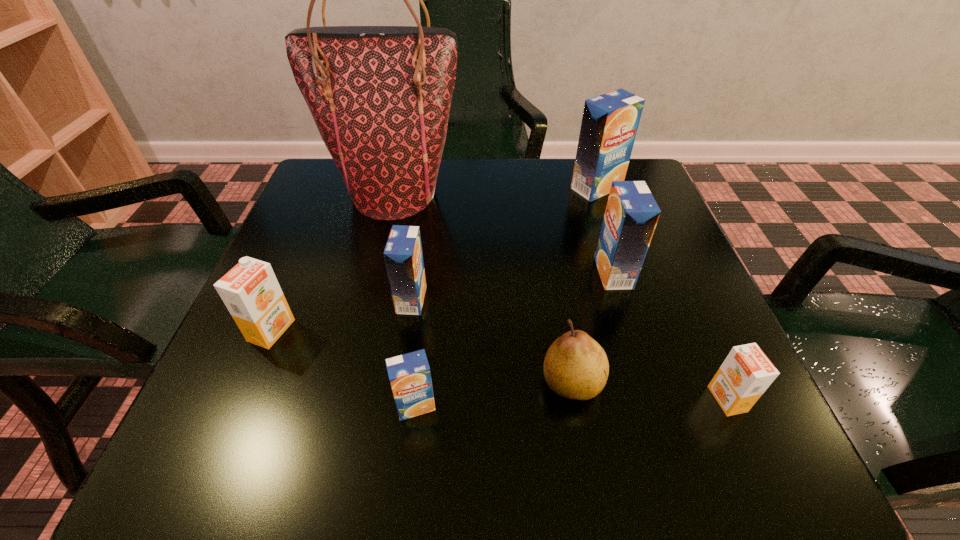
Where is `handbag`? handbag is located at coordinates (380, 96).

Locate an element on the screen. The width and height of the screenshot is (960, 540). the biggest blue orange_juice is located at coordinates (610, 121).

Identify the location of the farthest blue orange_juice. (610, 121).

Find the location of a particular element. the third tallest object is located at coordinates (631, 215).

You are a GUI agent. You are given a task and a screenshot of the screen. Output one action in this format:
    pyautogui.click(x=<x>, y=<y>)
    Task: Click on the second tallest orange juice
    The image size is (960, 540).
    Given the screenshot: What is the action you would take?
    pyautogui.click(x=631, y=215)

Locate an element on the screen. This screenshot has width=960, height=540. the third biggest blue orange_juice is located at coordinates (403, 255).

At what (x,y) coordinates should I click in order to perform the action: click on the farther orange orange juice. Please return your answer as a coordinate pair (x, y). Looking at the image, I should click on (250, 290).

Where is `the bigger orange orange juice`? This screenshot has height=540, width=960. the bigger orange orange juice is located at coordinates (250, 290).

Find the location of `brown pear`. brown pear is located at coordinates 576,367.

Where is `pear`? pear is located at coordinates pyautogui.click(x=576, y=367).